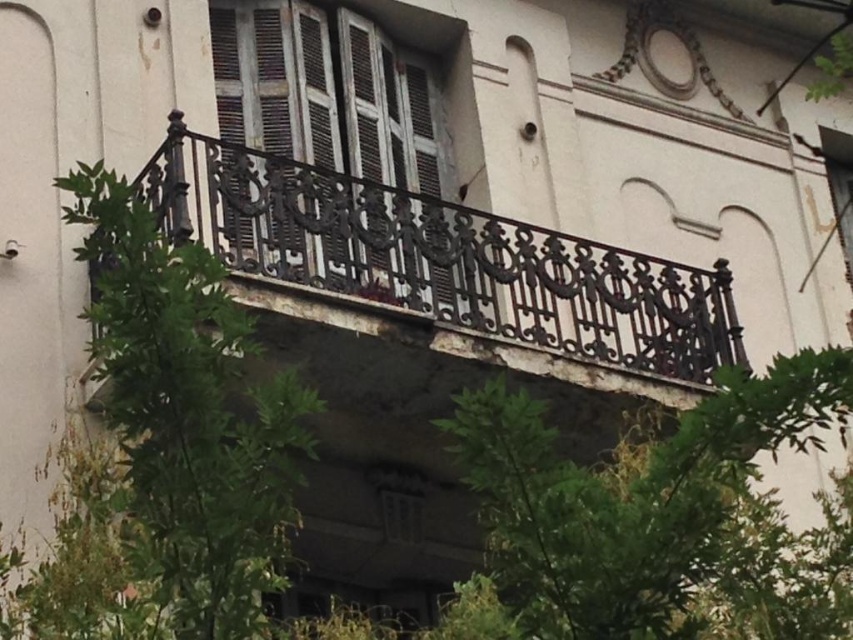
You are standing on the balcony looking at the rusty metal balustrade at upper center and the green leafy tree at center. Which object takes up more visual space in the scene?

The green leafy tree at center takes up more visual space than the rusty metal balustrade at upper center because the balustrade occupies less space according to the description.

You are standing on the balcony looking at the green leafy tree at center and the wooden shutters at center. Which object is shorter?

The green leafy tree at center is shorter than the wooden shutters at center.